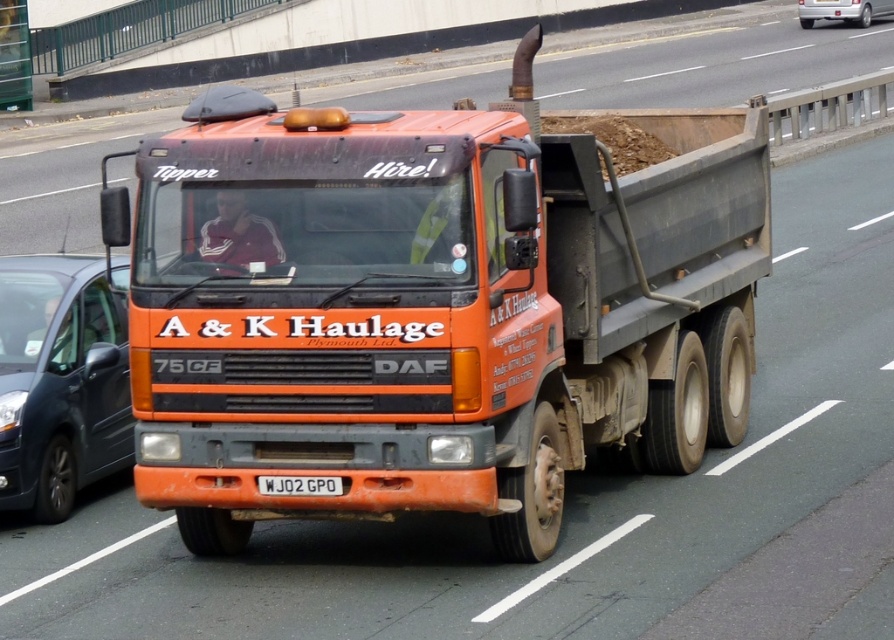
Question: Which is nearer to the matte black van at left?

Choices:
 (A) orange matte truck at center
 (B) silver metallic sedan at upper right

Answer: (A)

Question: Can you confirm if orange matte truck at center is positioned above matte black van at left?

Choices:
 (A) yes
 (B) no

Answer: (B)

Question: Which object appears farthest from the camera in this image?

Choices:
 (A) white plastic license plate at center
 (B) matte black van at left
 (C) silver metallic sedan at upper right
 (D) orange matte truck at center

Answer: (C)

Question: Can you confirm if matte black van at left is positioned to the right of silver metallic sedan at upper right?

Choices:
 (A) no
 (B) yes

Answer: (A)

Question: Can you confirm if orange matte truck at center is positioned above matte black van at left?

Choices:
 (A) no
 (B) yes

Answer: (A)

Question: Which point is farther from the camera taking this photo?

Choices:
 (A) (855, 13)
 (B) (31, 356)

Answer: (A)